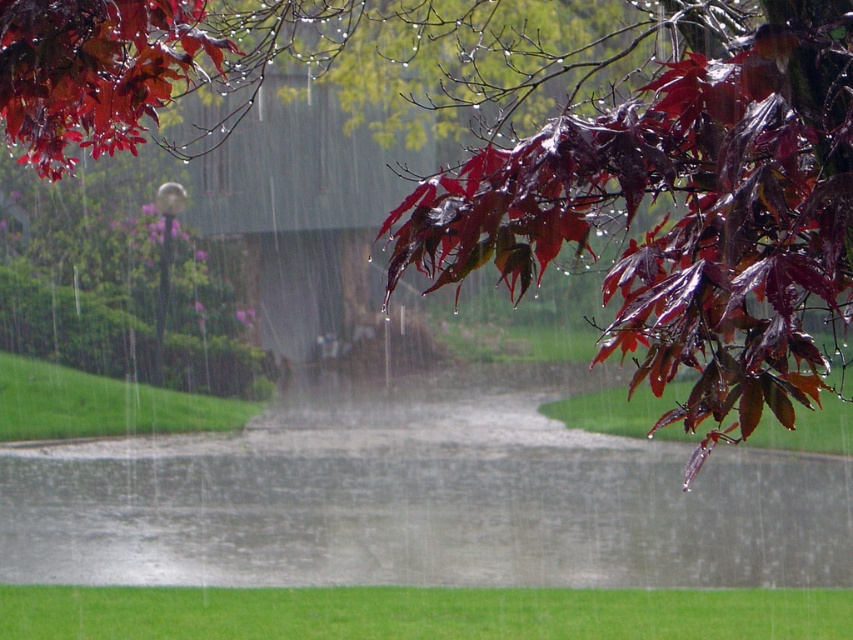
Question: Is glossy dark red maple leaves at upper right bigger than glossy red maple leaf at upper left?

Choices:
 (A) yes
 (B) no

Answer: (A)

Question: Which of the following is the closest to the observer?

Choices:
 (A) glossy red maple leaf at upper left
 (B) glossy dark red maple leaves at upper right

Answer: (B)

Question: Can you confirm if glossy dark red maple leaves at upper right is wider than glossy red maple leaf at upper left?

Choices:
 (A) yes
 (B) no

Answer: (A)

Question: Is glossy dark red maple leaves at upper right in front of glossy red maple leaf at upper left?

Choices:
 (A) no
 (B) yes

Answer: (B)

Question: Among these objects, which one is farthest from the camera?

Choices:
 (A) glossy dark red maple leaves at upper right
 (B) glossy red maple leaf at upper left

Answer: (B)